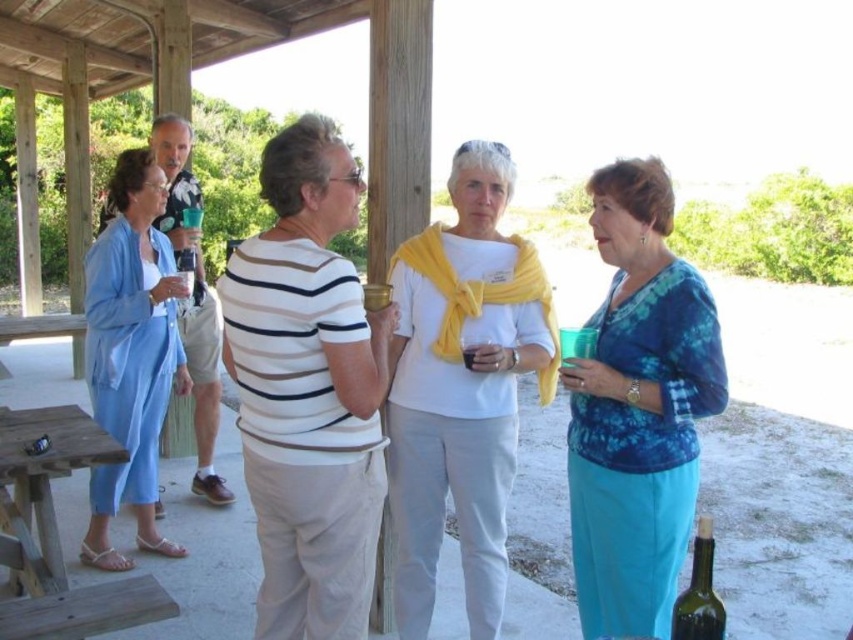
Question: Among these objects, which one is nearest to the camera?

Choices:
 (A) light blue fabric dress at left
 (B) translucent glass at center

Answer: (B)

Question: Which point is farther from the camera taking this photo?

Choices:
 (A) (469, 355)
 (B) (247, 321)

Answer: (A)

Question: Is blue tie-dye blouse at center thinner than wooden picnic table at lower left?

Choices:
 (A) yes
 (B) no

Answer: (A)

Question: Which object is the closest to the light blue fabric dress at left?

Choices:
 (A) translucent glass at center
 (B) green glass bottle at lower right
 (C) white matte scarf at center

Answer: (C)

Question: Is white matte scarf at center smaller than translucent glass at center?

Choices:
 (A) yes
 (B) no

Answer: (B)

Question: Can you confirm if wooden picnic table at lower left is smaller than green glass bottle at lower right?

Choices:
 (A) no
 (B) yes

Answer: (A)